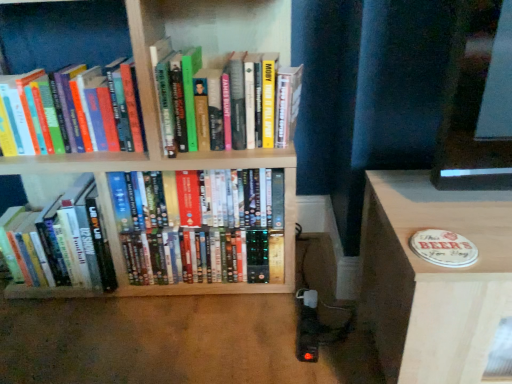
The width and height of the screenshot is (512, 384). I want to click on empty space that is ontop of wooden coaster at lower right (from a real-world perspective), so click(x=459, y=214).